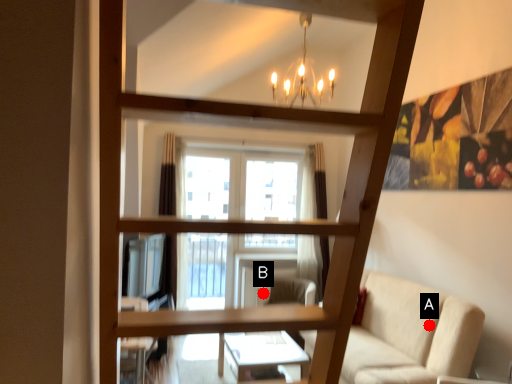
Question: Two points are circled on the image, labeled by A and B beside each circle. Which of the following is the farthest from the observer?

Choices:
 (A) A is further
 (B) B is further

Answer: (B)